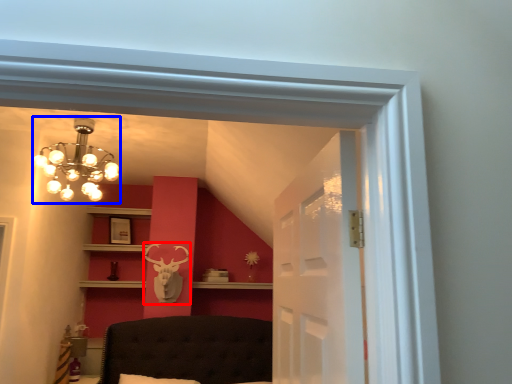
Question: Among these objects, which one is nearest to the camera, deer (highlighted by a red box) or lamp (highlighted by a blue box)?

Choices:
 (A) deer
 (B) lamp

Answer: (B)